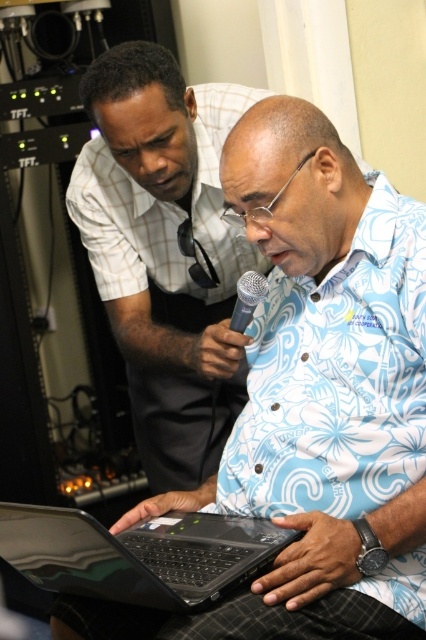
Who is positioned more to the left, blue floral shirt at center or black matte microphone at center?

From the viewer's perspective, blue floral shirt at center appears more on the left side.

Is blue floral shirt at center to the left of black matte microphone at center from the viewer's perspective?

Yes, blue floral shirt at center is to the left of black matte microphone at center.

Between point (192, 356) and point (242, 296), which one is positioned in front?

Point (242, 296)

In order to click on blue floral shirt at center in this screenshot , I will do `click(164, 248)`.

Is point (126, 234) positioned behind point (175, 552)?

Yes, point (126, 234) is behind point (175, 552).

Can you confirm if blue floral shirt at center is smaller than black matte laptop at center?

No.

Does point (141, 410) lie in front of point (17, 563)?

No, (141, 410) is further to viewer.

Locate an element on the screen. blue floral shirt at center is located at coordinates (164, 248).

Does black matte laptop at center have a greater height compared to black matte microphone at center?

Correct, black matte laptop at center is much taller as black matte microphone at center.

From the picture: Is the position of black matte laptop at center more distant than that of black matte microphone at center?

That is False.

Is point (58, 554) farther from camera compared to point (245, 317)?

No, (58, 554) is in front of (245, 317).

Identify the location of black matte laptop at center. The image size is (426, 640). (138, 554).